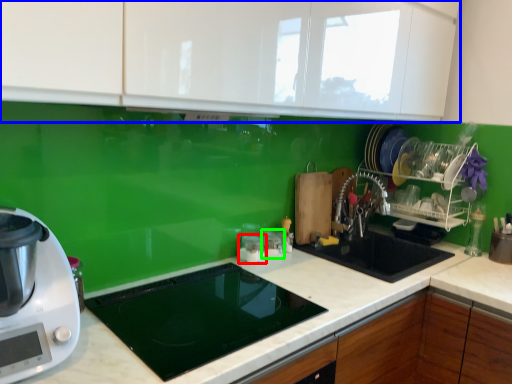
Question: Considering the real-world distances, which object is farthest from appliance (highlighted by a red box)? cabinetry (highlighted by a blue box) or appliance (highlighted by a green box)?

Choices:
 (A) cabinetry
 (B) appliance

Answer: (A)